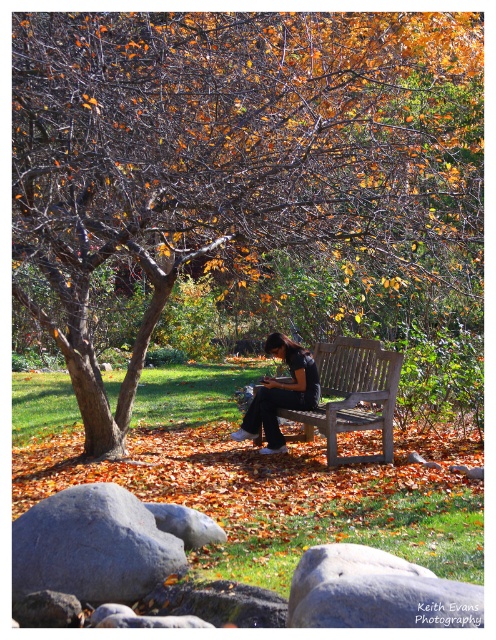
Between point (461, 112) and point (317, 385), which one is positioned behind?

Positioned behind is point (461, 112).

Who is taller, brown wood tree at center or black fabric shirt at center?

black fabric shirt at center

This screenshot has width=496, height=640. What do you see at coordinates (227, 150) in the screenshot? I see `brown wood tree at center` at bounding box center [227, 150].

This screenshot has height=640, width=496. What are the coordinates of `brown wood tree at center` in the screenshot? It's located at (227, 150).

Is brown wood tree at center positioned in front of wooden bench at center?

That is False.

Who is more distant from viewer, (362, 221) or (338, 362)?

The point (338, 362) is behind.

In order to click on brown wood tree at center in this screenshot , I will do [227, 150].

Can you confirm if wooden bench at center is positioned below black fabric shirt at center?

No.

Between point (304, 413) and point (289, 369), which one is positioned in front?

Positioned in front is point (304, 413).

This screenshot has height=640, width=496. What are the coordinates of `wooden bench at center` in the screenshot? It's located at (352, 396).